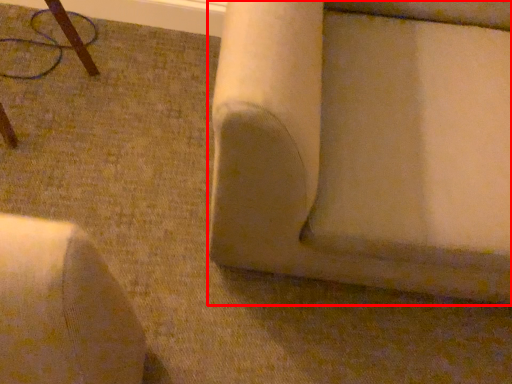
Question: In this image, where is furniture (annotated by the red box) located relative to furniture?

Choices:
 (A) left
 (B) right

Answer: (B)